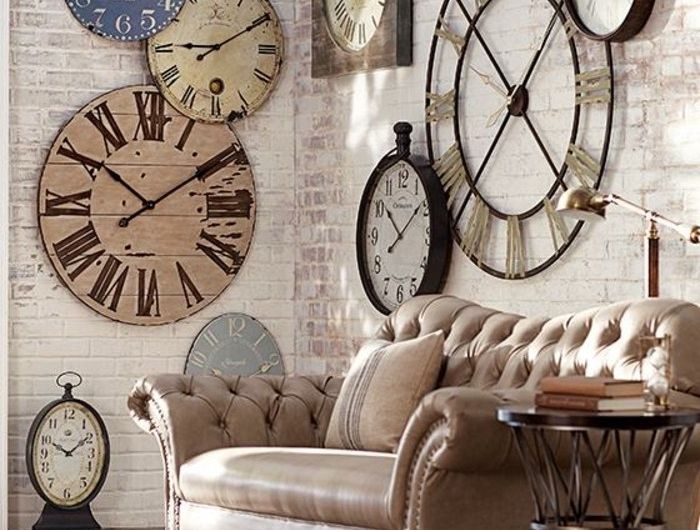
At what (x,y) coordinates should I click in order to perform the action: click on clock faces. Please return your answer as a coordinate pair (x, y). Looking at the image, I should click on (71, 454), (232, 362), (174, 229), (412, 238), (517, 105), (596, 25), (358, 11), (242, 49), (126, 6).